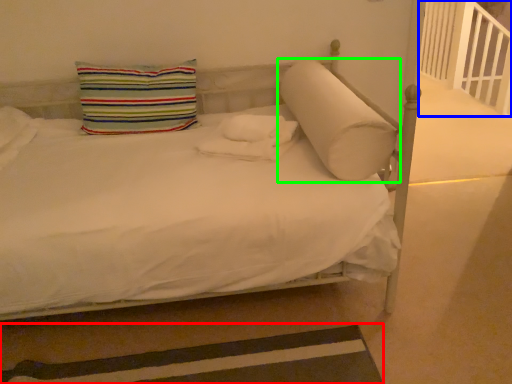
Question: Which object is positioned farthest from strip (highlighted by a red box)? Select from balustrade (highlighted by a blue box) and pillow (highlighted by a green box).

Choices:
 (A) balustrade
 (B) pillow

Answer: (A)